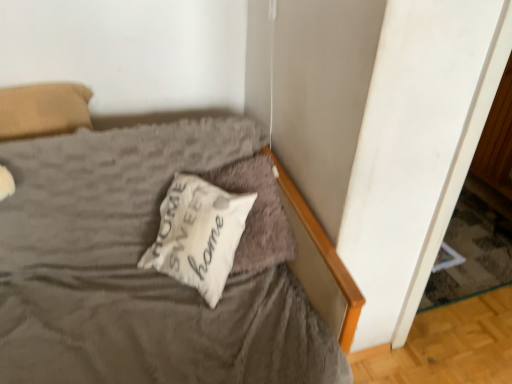
What is the approximate width of white soft pillow at center, placed as the 2th pillow when sorted from left to right?

It is 14.77 inches.

What do you see at coordinates (257, 214) in the screenshot?
I see `white soft pillow at center, placed as the 2th pillow when sorted from left to right` at bounding box center [257, 214].

Locate an element on the screen. The image size is (512, 384). white soft pillow at center, placed as the 2th pillow when sorted from left to right is located at coordinates (257, 214).

Measure the distance between point (274, 178) and camera.

Point (274, 178) is 4.85 feet from camera.

You are a GUI agent. You are given a task and a screenshot of the screen. Output one action in this format:
    pyautogui.click(x=<x>, y=<y>)
    Task: Click on the white soft pillow at center, which is the 2th pillow in right-to-left order
    
    Given the screenshot: What is the action you would take?
    pyautogui.click(x=198, y=234)

In order to face white soft pillow at center, acting as the 1th pillow starting from the left, should I rotate leftwards or rightwards?

It's best to rotate left around 7.537 degrees.

This screenshot has height=384, width=512. What do you see at coordinates (198, 234) in the screenshot?
I see `white soft pillow at center, acting as the 1th pillow starting from the left` at bounding box center [198, 234].

Identify the location of white soft pillow at center, placed as the 1th pillow when sorted from right to left. (257, 214).

Which is more to the left, white soft pillow at center, which is the 2th pillow in right-to-left order, or white soft pillow at center, placed as the 1th pillow when sorted from right to left?

From the viewer's perspective, white soft pillow at center, which is the 2th pillow in right-to-left order, appears more on the left side.

Based on the photo, is white soft pillow at center, acting as the 1th pillow starting from the left, positioned in front of white soft pillow at center, placed as the 1th pillow when sorted from right to left?

Yes, it is.

Is point (221, 242) closer to viewer compared to point (260, 269)?

That is True.

From the image's perspective, is white soft pillow at center, which is the 2th pillow in right-to-left order, located above white soft pillow at center, placed as the 2th pillow when sorted from left to right?

No, from the image's perspective, white soft pillow at center, which is the 2th pillow in right-to-left order, is not on top of white soft pillow at center, placed as the 2th pillow when sorted from left to right.

From a real-world perspective, is white soft pillow at center, which is the 2th pillow in right-to-left order, above or below white soft pillow at center, placed as the 1th pillow when sorted from right to left?

Clearly, from a real-world perspective, white soft pillow at center, which is the 2th pillow in right-to-left order, is above white soft pillow at center, placed as the 1th pillow when sorted from right to left.

Is white soft pillow at center, which is the 2th pillow in right-to-left order, thinner than white soft pillow at center, placed as the 1th pillow when sorted from right to left?

Indeed, white soft pillow at center, which is the 2th pillow in right-to-left order, has a lesser width compared to white soft pillow at center, placed as the 1th pillow when sorted from right to left.

Consider the image. Considering the sizes of objects white soft pillow at center, acting as the 1th pillow starting from the left, and white soft pillow at center, placed as the 2th pillow when sorted from left to right, in the image provided, who is taller, white soft pillow at center, acting as the 1th pillow starting from the left, or white soft pillow at center, placed as the 2th pillow when sorted from left to right,?

white soft pillow at center, placed as the 2th pillow when sorted from left to right, is taller.

Considering the relative sizes of white soft pillow at center, which is the 2th pillow in right-to-left order, and white soft pillow at center, placed as the 1th pillow when sorted from right to left, in the image provided, is white soft pillow at center, which is the 2th pillow in right-to-left order, smaller than white soft pillow at center, placed as the 1th pillow when sorted from right to left,?

Indeed, white soft pillow at center, which is the 2th pillow in right-to-left order, has a smaller size compared to white soft pillow at center, placed as the 1th pillow when sorted from right to left.

Would you say white soft pillow at center, placed as the 1th pillow when sorted from right to left, is part of white soft pillow at center, which is the 2th pillow in right-to-left order,'s contents?

Yes, white soft pillow at center, which is the 2th pillow in right-to-left order, is surrounding white soft pillow at center, placed as the 1th pillow when sorted from right to left.

Is there a large distance between white soft pillow at center, which is the 2th pillow in right-to-left order, and white soft pillow at center, placed as the 1th pillow when sorted from right to left?

white soft pillow at center, which is the 2th pillow in right-to-left order, is actually quite close to white soft pillow at center, placed as the 1th pillow when sorted from right to left.

Could you tell me if white soft pillow at center, which is the 2th pillow in right-to-left order, is turned towards white soft pillow at center, placed as the 2th pillow when sorted from left to right?

Yes, white soft pillow at center, which is the 2th pillow in right-to-left order, is aimed at white soft pillow at center, placed as the 2th pillow when sorted from left to right.

From the picture: How much distance is there between white soft pillow at center, which is the 2th pillow in right-to-left order, and white soft pillow at center, placed as the 2th pillow when sorted from left to right?

5.18 inches.

Find the location of a particular element. pillow beneath the white soft pillow at center, acting as the 1th pillow starting from the left (from a real-world perspective) is located at coordinates (257, 214).

Based on their positions, is white soft pillow at center, placed as the 1th pillow when sorted from right to left, located to the left or right of white soft pillow at center, which is the 2th pillow in right-to-left order?

white soft pillow at center, placed as the 1th pillow when sorted from right to left, is to the right of white soft pillow at center, which is the 2th pillow in right-to-left order.

Looking at this image, considering their positions, is white soft pillow at center, placed as the 2th pillow when sorted from left to right, located in front of or behind white soft pillow at center, acting as the 1th pillow starting from the left?

white soft pillow at center, placed as the 2th pillow when sorted from left to right, is positioned farther from the viewer than white soft pillow at center, acting as the 1th pillow starting from the left.

Considering the positions of point (278, 259) and point (225, 228), is point (278, 259) closer or farther from the camera than point (225, 228)?

Point (278, 259) is farther from the camera than point (225, 228).

From the image's perspective, is white soft pillow at center, placed as the 1th pillow when sorted from right to left, on top of white soft pillow at center, which is the 2th pillow in right-to-left order?

Yes, from the image's perspective, white soft pillow at center, placed as the 1th pillow when sorted from right to left, is above white soft pillow at center, which is the 2th pillow in right-to-left order.

From a real-world perspective, which is physically below, white soft pillow at center, placed as the 1th pillow when sorted from right to left, or white soft pillow at center, which is the 2th pillow in right-to-left order?

In real-world perspective, white soft pillow at center, placed as the 1th pillow when sorted from right to left, is lower.

Is white soft pillow at center, placed as the 1th pillow when sorted from right to left, thinner than white soft pillow at center, which is the 2th pillow in right-to-left order?

No.

Considering the sizes of white soft pillow at center, placed as the 2th pillow when sorted from left to right, and white soft pillow at center, which is the 2th pillow in right-to-left order, in the image, is white soft pillow at center, placed as the 2th pillow when sorted from left to right, taller or shorter than white soft pillow at center, which is the 2th pillow in right-to-left order,?

white soft pillow at center, placed as the 2th pillow when sorted from left to right, is taller than white soft pillow at center, which is the 2th pillow in right-to-left order.

Based on their sizes in the image, would you say white soft pillow at center, placed as the 1th pillow when sorted from right to left, is bigger or smaller than white soft pillow at center, which is the 2th pillow in right-to-left order?

Considering their sizes, white soft pillow at center, placed as the 1th pillow when sorted from right to left, takes up more space than white soft pillow at center, which is the 2th pillow in right-to-left order.

Is white soft pillow at center, placed as the 1th pillow when sorted from right to left, spatially inside white soft pillow at center, which is the 2th pillow in right-to-left order, or outside of it?

white soft pillow at center, placed as the 1th pillow when sorted from right to left, lies within the bounds of white soft pillow at center, which is the 2th pillow in right-to-left order.

Is there a large distance between white soft pillow at center, placed as the 2th pillow when sorted from left to right, and white soft pillow at center, acting as the 1th pillow starting from the left?

They are positioned close to each other.

In the scene shown: Is white soft pillow at center, placed as the 2th pillow when sorted from left to right, turned away from white soft pillow at center, acting as the 1th pillow starting from the left?

Yes, white soft pillow at center, acting as the 1th pillow starting from the left, is at the back of white soft pillow at center, placed as the 2th pillow when sorted from left to right.

What's the angular difference between white soft pillow at center, placed as the 2th pillow when sorted from left to right, and white soft pillow at center, acting as the 1th pillow starting from the left,'s facing directions?

white soft pillow at center, placed as the 2th pillow when sorted from left to right, and white soft pillow at center, acting as the 1th pillow starting from the left, are facing 45.2 degrees away from each other.

The width and height of the screenshot is (512, 384). What are the coordinates of `pillow on the left of white soft pillow at center, placed as the 1th pillow when sorted from right to left` in the screenshot? It's located at (198, 234).

Identify the location of pillow lying above the white soft pillow at center, acting as the 1th pillow starting from the left (from the image's perspective). (257, 214).

At what (x,y) coordinates should I click in order to perform the action: click on pillow located below the white soft pillow at center, placed as the 2th pillow when sorted from left to right (from the image's perspective). Please return your answer as a coordinate pair (x, y). This screenshot has width=512, height=384. Looking at the image, I should click on (198, 234).